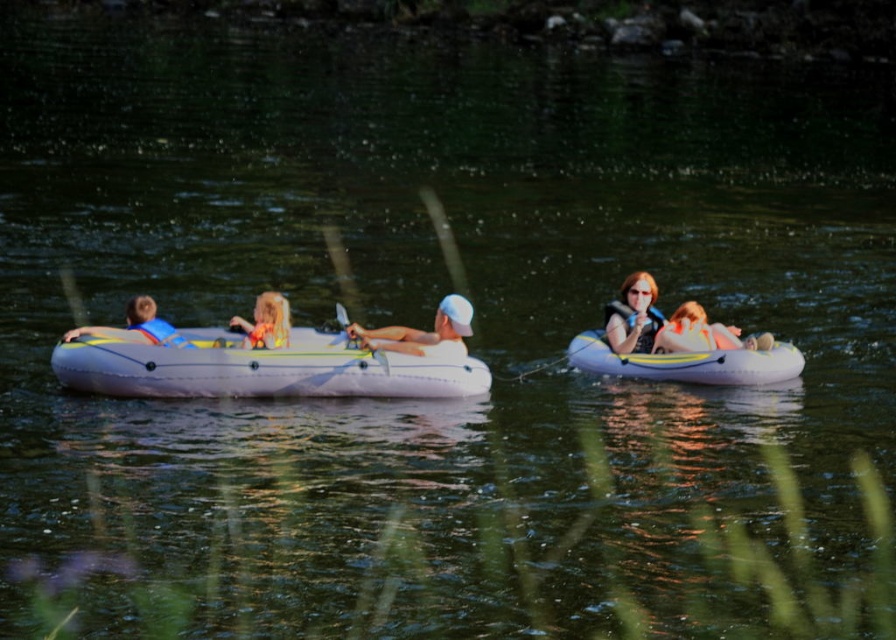
Can you confirm if white matte life vest at center is positioned to the left of matte yellow life vest at center?

Yes, white matte life vest at center is to the left of matte yellow life vest at center.

Who is more distant from viewer, [399,346] or [694,324]?

The point [694,324] is more distant.

Locate an element on the screen. white matte life vest at center is located at coordinates (423, 332).

From the picture: Is white rubber raft at center wider than matte blue life vest at left?

Yes.

Is point (239, 358) positioned in front of point (131, 307)?

Yes, it is in front of point (131, 307).

You are a GUI agent. You are given a task and a screenshot of the screen. Output one action in this format:
    pyautogui.click(x=<x>, y=<y>)
    Task: Click on the white rubber raft at center
    This screenshot has width=896, height=640.
    Given the screenshot: What is the action you would take?
    pyautogui.click(x=261, y=369)

Does multicolored fabric toy at center have a greater height compared to wooden paddle at center?

Yes, multicolored fabric toy at center is taller than wooden paddle at center.

The height and width of the screenshot is (640, 896). What are the coordinates of `multicolored fabric toy at center` in the screenshot? It's located at (265, 323).